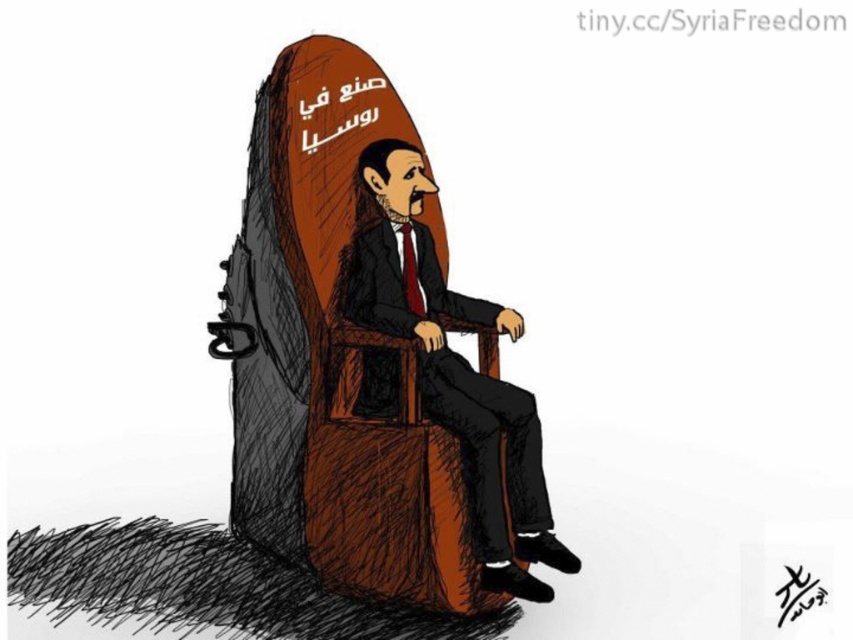
Between smooth brown chair at center and black ink signature at center, which one is positioned lower?

black ink signature at center

Between smooth brown chair at center and black ink signature at center, which one appears on the left side from the viewer's perspective?

smooth brown chair at center

Locate an element on the screen. smooth brown chair at center is located at coordinates (451, 369).

The width and height of the screenshot is (853, 640). What are the coordinates of `smooth brown chair at center` in the screenshot? It's located at (451, 369).

Does brown wooden armchair at center have a smaller size compared to smooth brown chair at center?

Actually, brown wooden armchair at center might be larger than smooth brown chair at center.

Is point (286, 104) positioned before point (380, 276)?

That is False.

You are a GUI agent. You are given a task and a screenshot of the screen. Output one action in this format:
    pyautogui.click(x=<x>, y=<y>)
    Task: Click on the brown wooden armchair at center
    The width and height of the screenshot is (853, 640).
    Given the screenshot: What is the action you would take?
    tap(332, 356)

Can you confirm if brown wooden armchair at center is smaller than black ink signature at center?

Actually, brown wooden armchair at center might be larger than black ink signature at center.

Does brown wooden armchair at center have a larger size compared to black ink signature at center?

Yes, brown wooden armchair at center is bigger than black ink signature at center.

Is point (279, 129) more distant than point (786, 604)?

Yes.

You are a GUI agent. You are given a task and a screenshot of the screen. Output one action in this format:
    pyautogui.click(x=<x>, y=<y>)
    Task: Click on the brown wooden armchair at center
    The width and height of the screenshot is (853, 640).
    Given the screenshot: What is the action you would take?
    pyautogui.click(x=332, y=356)